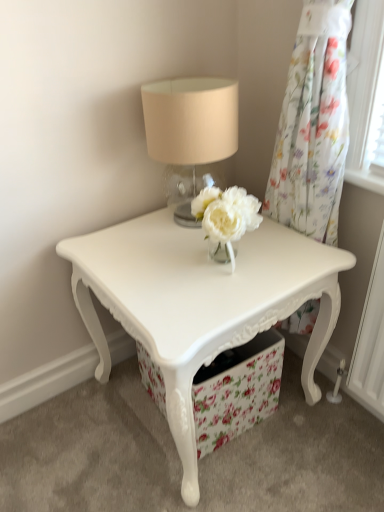
Locate an element on the screen. The height and width of the screenshot is (512, 384). vacant area in front of floral fabric drawer at center is located at coordinates (226, 476).